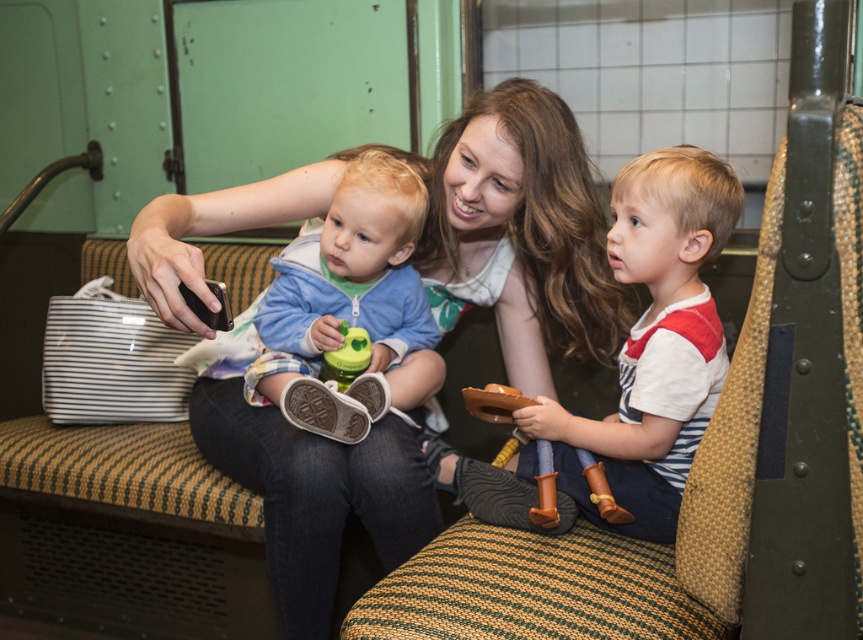
You are a photographer trying to capture the striped cotton shirt at center and the light blue fleece jacket at center in the same frame. Which one should you focus on first to ensure both are in focus?

The striped cotton shirt at center is positioned under the light blue fleece jacket at center, so you should focus on the light blue fleece jacket at center first to ensure both are in focus.

You are a photographer trying to capture the perfect shot of the matte green shirt at center and the striped cotton shirt at center. Which shirt should you focus on first if you want to include both in your frame without moving the camera?

The matte green shirt at center is located above the striped cotton shirt at center, so you should focus on the striped cotton shirt at center first to ensure both shirts are in the frame without moving the camera.